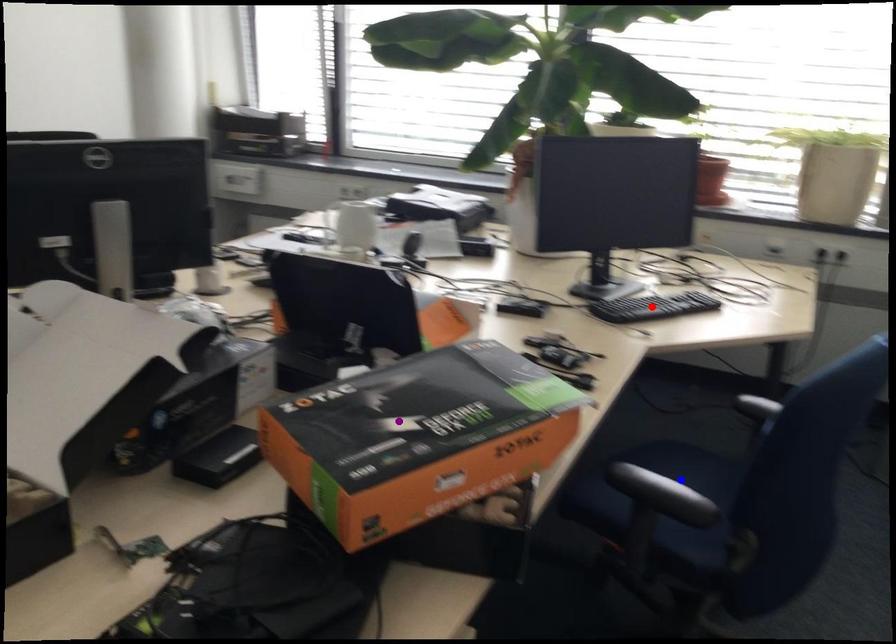
Order these from nearest to farthest:
A) red point
B) blue point
C) purple point

purple point → blue point → red point